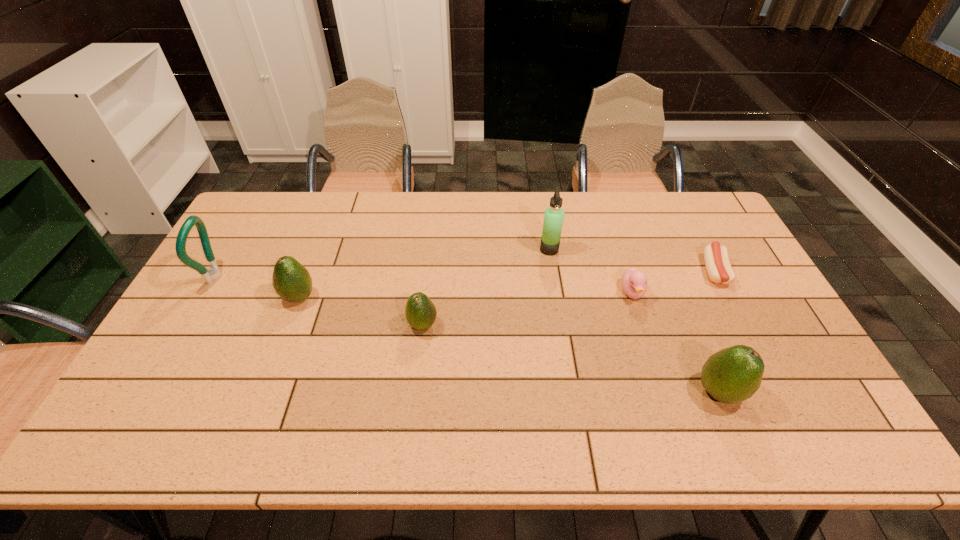
Identify the location of sausage. (716, 257).

This screenshot has width=960, height=540. Find the location of `the rightmost object`. the rightmost object is located at coordinates (716, 257).

The image size is (960, 540). Find the location of `vacant space located on the back of the fourth shortest object`. vacant space located on the back of the fourth shortest object is located at coordinates (314, 258).

The image size is (960, 540). Find the location of `free location located 0.050m on the front of the second farthest avocado`. free location located 0.050m on the front of the second farthest avocado is located at coordinates (420, 353).

This screenshot has width=960, height=540. What are the coordinates of `vacant area situated on the left of the sixth object from left to right` in the screenshot? It's located at (618, 392).

At what (x,y) coordinates should I click in order to perform the action: click on vacant space located on the front-facing side of the second shortest object. Please return your answer as a coordinate pair (x, y). Looking at the image, I should click on (649, 343).

You are a GUI agent. You are given a task and a screenshot of the screen. Output one action in this format:
    pyautogui.click(x=<x>, y=<y>)
    Task: Click on the free space located on the back of the thermos bottle
    
    Given the screenshot: What is the action you would take?
    pyautogui.click(x=543, y=215)

Locate an element on the screen. The height and width of the screenshot is (540, 960). blank space located at the jaws of the leftmost object is located at coordinates (319, 276).

Where is `vacant space located on the front of the sausage`? vacant space located on the front of the sausage is located at coordinates (742, 325).

Locate an element on the screen. object at the near edge is located at coordinates click(732, 375).